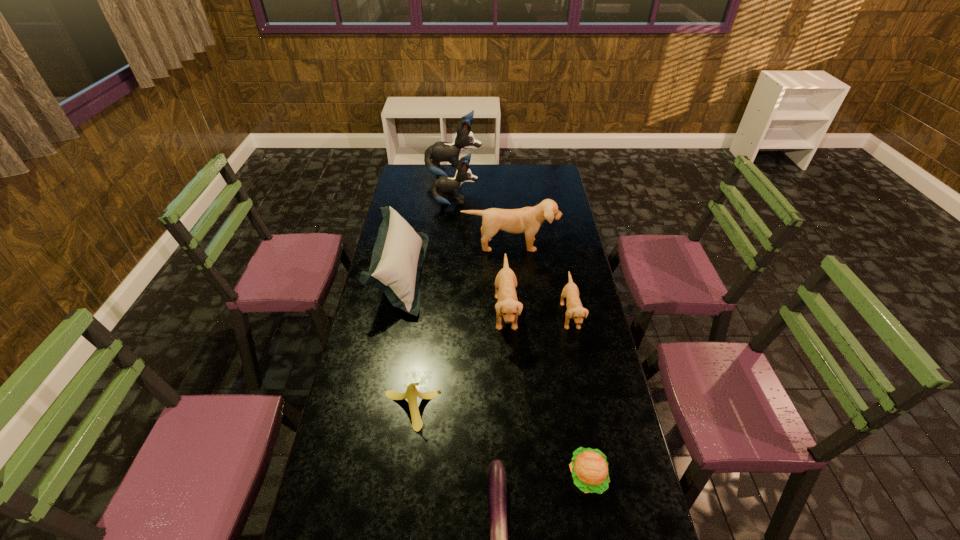
Select which puppy is the fourth closest to the shortest object. Please provide its 2D coordinates. Your answer should be formatted as a tuple, i.e. [(x, y)], where the tuple contains the x and y coordinates of a point satisfying the conditions above.

[(444, 184)]

At what (x,y) coordinates should I click in order to perform the action: click on beige puppy identified as the third closest to the white cushion. Please return your answer as a coordinate pair (x, y). Looking at the image, I should click on coord(575,310).

I want to click on the closest beige puppy relative to the smaller black puppy, so click(x=528, y=220).

Find the location of a particular element. The image size is (960, 540). free space that satisfies the following two spatial constraints: 1. on the front side of the hamburger; 2. on the right side of the third nearest object is located at coordinates (402, 477).

Locate an element on the screen. The height and width of the screenshot is (540, 960). vacant space that satisfies the following two spatial constraints: 1. on the left side of the eighth tallest object; 2. on the right side of the second smallest beige puppy is located at coordinates (516, 477).

At what (x,y) coordinates should I click in order to perform the action: click on free spot that satisfies the following two spatial constraints: 1. on the left side of the farthest beige puppy; 2. on the left side of the second smallest beige puppy. Please return your answer as a coordinate pair (x, y). Looking at the image, I should click on (516, 312).

The height and width of the screenshot is (540, 960). I want to click on blank area in the image that satisfies the following two spatial constraints: 1. on the front-facing side of the farthest object; 2. on the left side of the hamburger, so click(428, 477).

You are a GUI agent. You are given a task and a screenshot of the screen. Output one action in this format:
    pyautogui.click(x=<x>, y=<y>)
    Task: Click on the free space in the image that satisfies the following two spatial constraints: 1. on the front-facing side of the eighth nearest object; 2. on the right side of the eighth tallest object
    
    Given the screenshot: What is the action you would take?
    pyautogui.click(x=435, y=477)